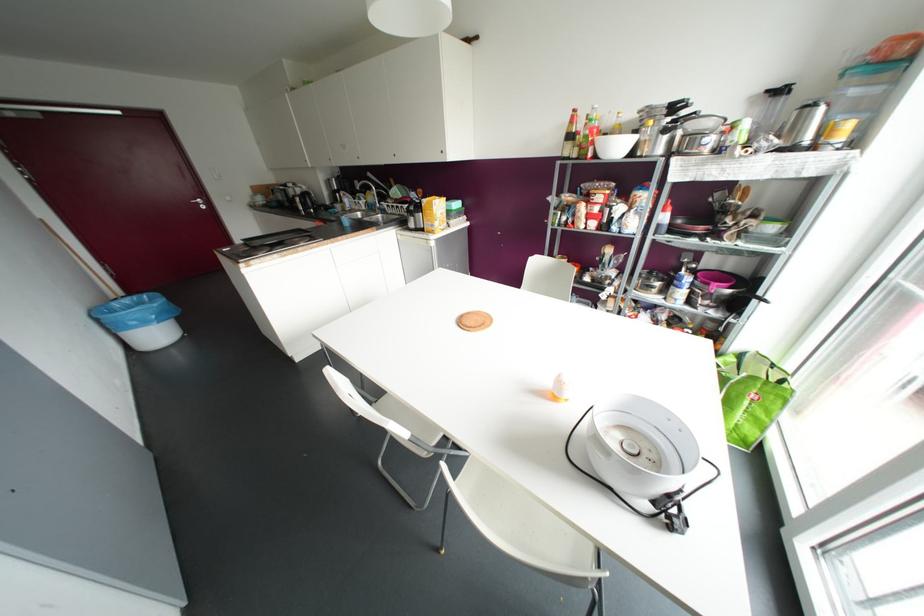
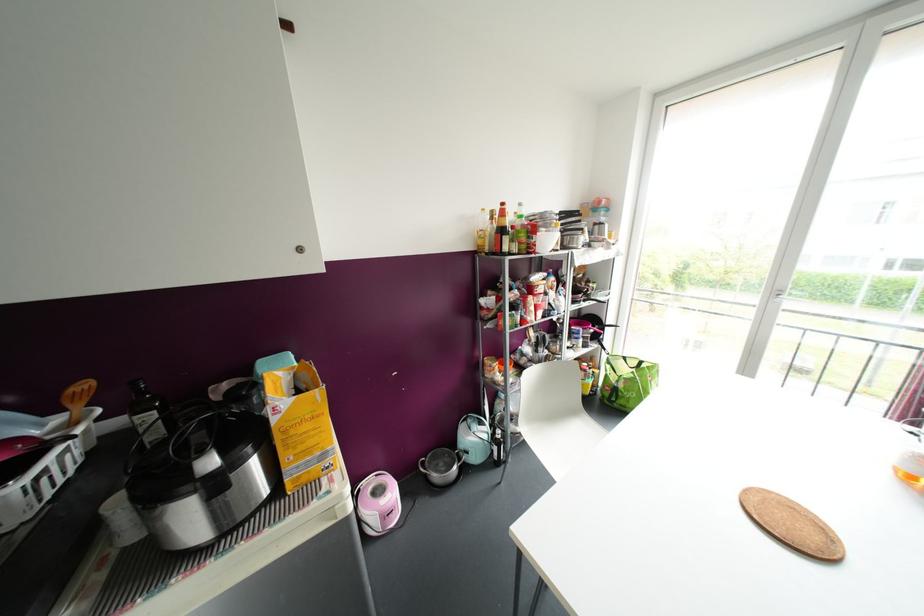
Where in the second image is the point corresponding to pixel 574 110 from the first image?

(502, 204)